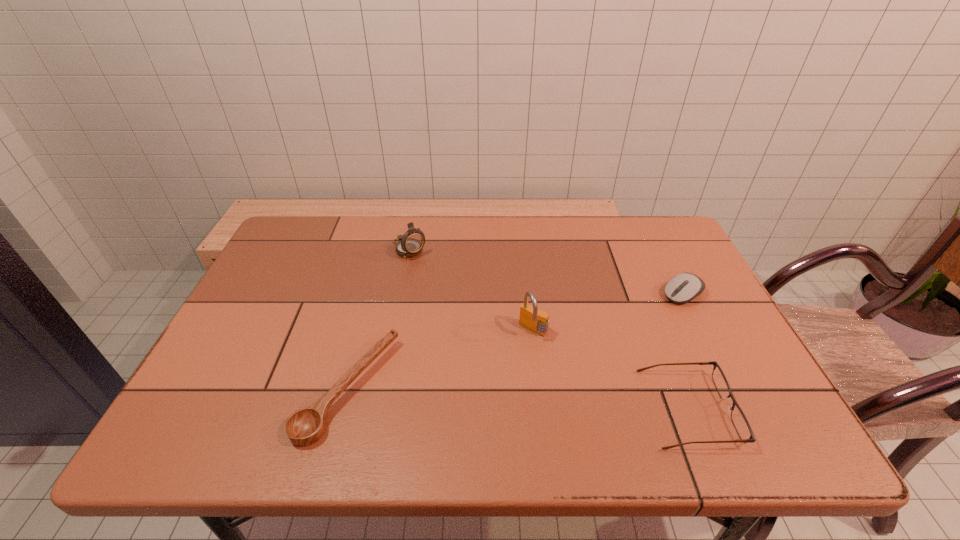
Where is `wooden spoon`? The height and width of the screenshot is (540, 960). wooden spoon is located at coordinates (304, 427).

The image size is (960, 540). Find the location of `spectacles`. spectacles is located at coordinates [740, 422].

Find the location of a particular element. the fourth nearest object is located at coordinates (683, 288).

You are a GUI agent. You are given a task and a screenshot of the screen. Output one action in this format:
    pyautogui.click(x=<x>, y=<y>)
    Task: Click on the compass
    This screenshot has width=960, height=540.
    Given the screenshot: What is the action you would take?
    pyautogui.click(x=411, y=243)

At what (x,y) coordinates should I click in order to perform the action: click on padlock. Please return your answer as a coordinate pair (x, y). Looking at the image, I should click on (535, 320).

Find the location of a particular element. the third object from left to right is located at coordinates (535, 320).

The width and height of the screenshot is (960, 540). I want to click on vacant region located 0.140m on the back of the wooden spoon, so click(x=372, y=301).

Where is `vacant space located on the wheel side of the second farthest object`? vacant space located on the wheel side of the second farthest object is located at coordinates (630, 327).

The image size is (960, 540). I want to click on vacant position located on the wheel side of the second farthest object, so click(653, 313).

Locate an element on the screen. vacant space located on the wheel side of the second farthest object is located at coordinates (653, 313).